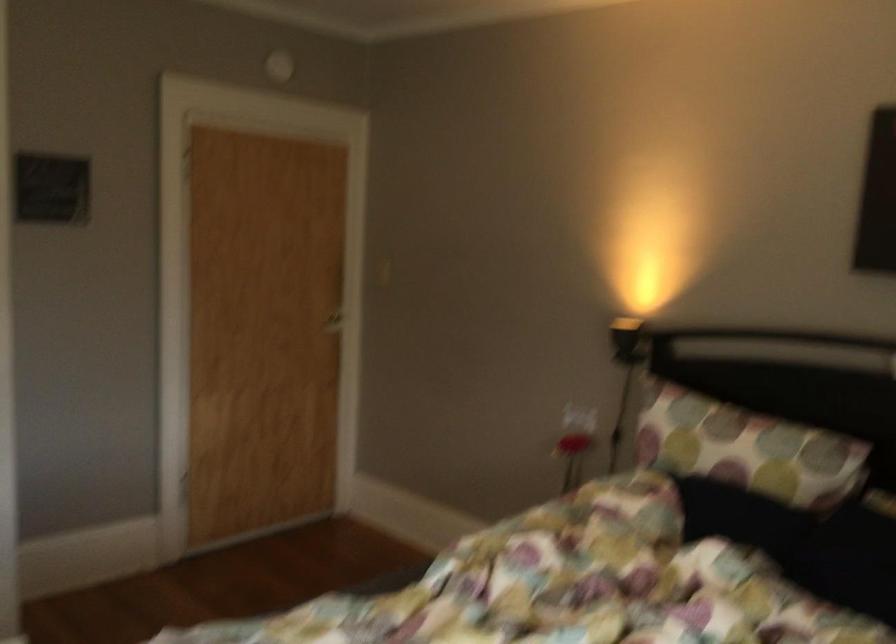
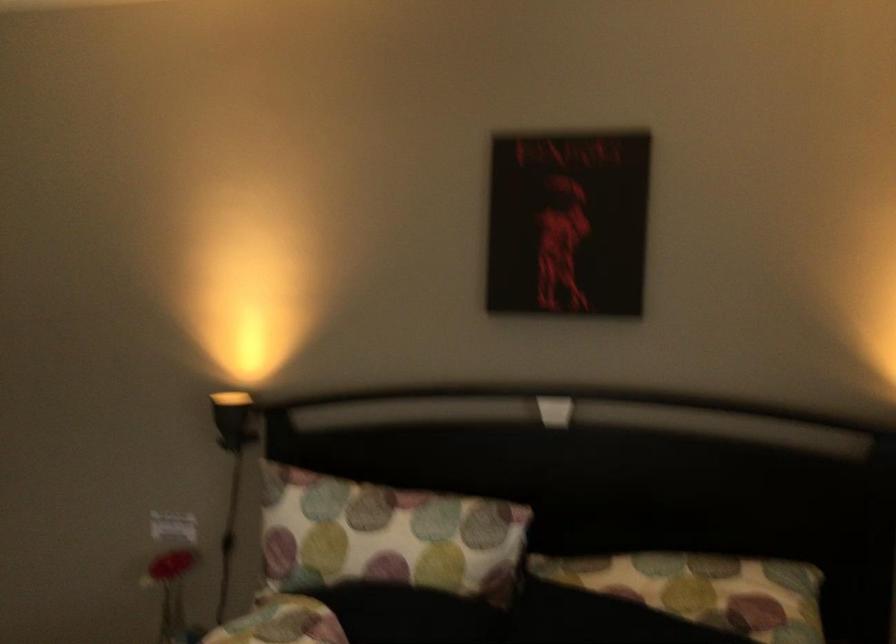
Question: The first image is from the beginning of the video and the second image is from the end. How did the camera likely rotate when shooting the video?

Choices:
 (A) Left
 (B) Right
 (C) Up
 (D) Down

Answer: (B)